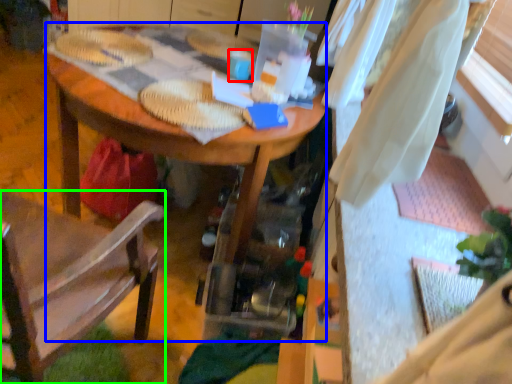
Question: Which object is positioned closest to coffee cup (highlighted by a red box)? Select from desk (highlighted by a blue box) and chair (highlighted by a green box).

Choices:
 (A) desk
 (B) chair

Answer: (A)